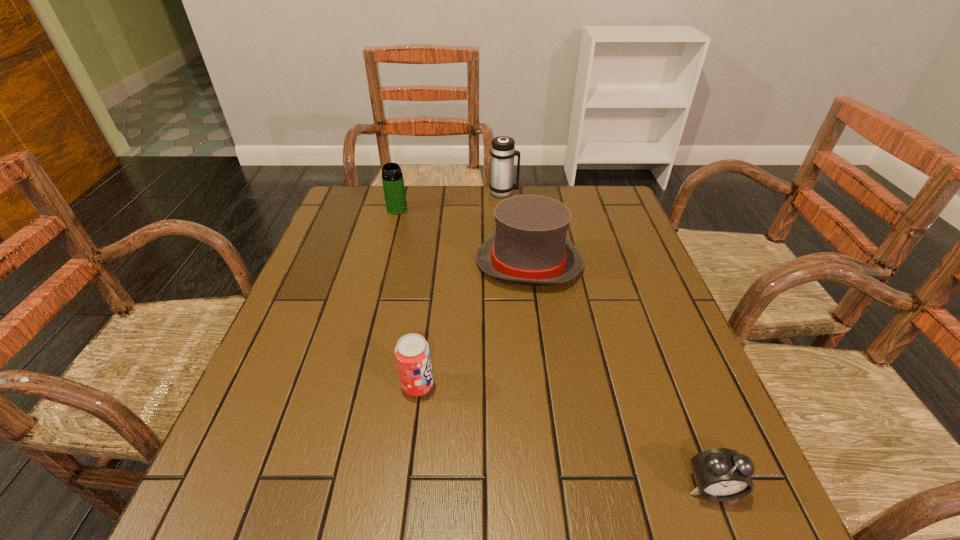
The width and height of the screenshot is (960, 540). Identify the location of vacant space that's between the soda can and the third nearest object. (473, 325).

This screenshot has width=960, height=540. I want to click on free space between the fourth tallest object and the dress hat, so click(x=473, y=325).

The height and width of the screenshot is (540, 960). I want to click on vacant point located between the nearest object and the second object from left to right, so click(564, 436).

What are the coordinates of `vacant region between the third farthest object and the shortest object` in the screenshot? It's located at (620, 376).

Image resolution: width=960 pixels, height=540 pixels. I want to click on the closest object to the second nearest object, so click(530, 246).

Locate an element on the screen. This screenshot has height=540, width=960. object that is the second closest to the farthest object is located at coordinates (393, 184).

Locate an element on the screen. free spot that satisfies the following two spatial constraints: 1. on the back side of the dress hat; 2. on the side with the handle of the farther thermos bottle is located at coordinates (x=519, y=193).

Identify the location of vacant point that satisfies the following two spatial constraints: 1. from the spout of the third nearest object; 2. on the right side of the left thermos bottle. This screenshot has height=540, width=960. (383, 264).

Locate an element on the screen. The height and width of the screenshot is (540, 960). vacant area in the image that satisfies the following two spatial constraints: 1. on the back side of the third nearest object; 2. on the side with the handle of the farther thermos bottle is located at coordinates (519, 193).

Find the location of a particular element. The image size is (960, 540). vacant space that satisfies the following two spatial constraints: 1. on the side with the handle of the farthest object; 2. on the front side of the second object from left to right is located at coordinates (518, 386).